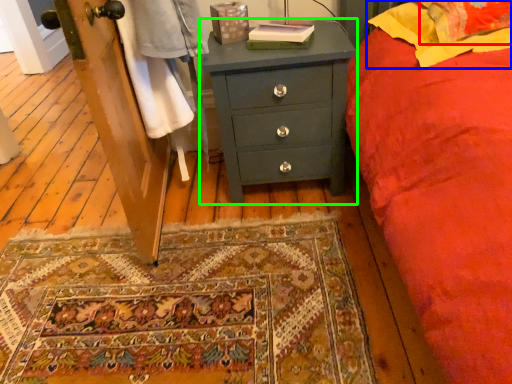
Question: Which object is the closest to the pillow (highlighted by a red box)? Choose among these: pillow (highlighted by a blue box) or chest of drawers (highlighted by a green box).

Choices:
 (A) pillow
 (B) chest of drawers

Answer: (A)